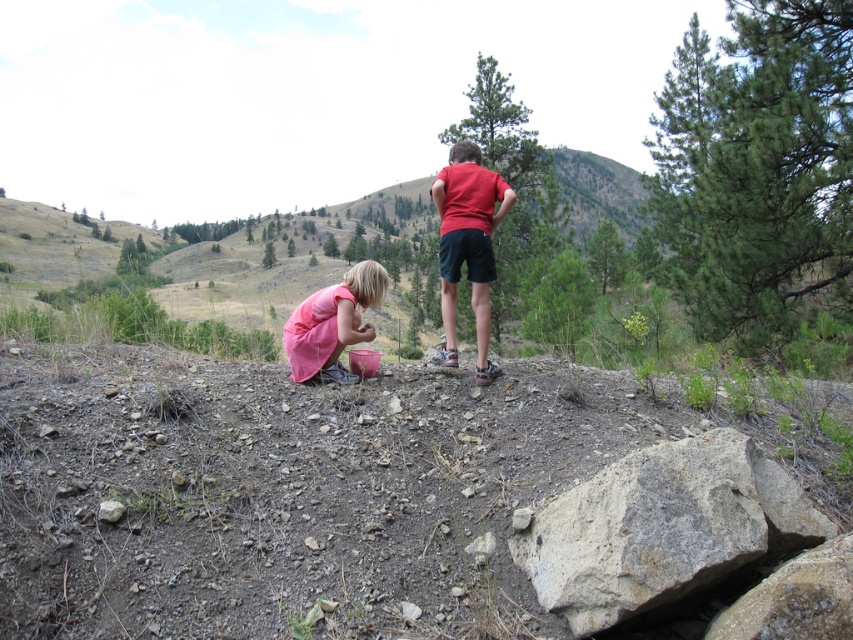
You are a photographer trying to capture both the red matte shirt at center and the pink matte dress at lower center in a single shot. Based on their positions, which one would appear closer to the camera in the photo?

The red matte shirt at center appears closer to the camera because it is positioned in front of the pink matte dress at lower center.

In the scene shown: You are a photographer trying to capture the gray rough rock at lower right in your shot. Based on the scene description, where should you position your camera to ensure the rock is centered in the frame?

The gray rough rock at lower right is located at the 2D coordinates point (x=662, y=528), so position the camera so that the center of the frame aligns with this coordinate to center the rock.

Looking at this image, you are a photographer trying to capture a clear photo of the pink matte dress at lower center without the gray rough rock at lower right blocking it. How should you adjust your camera position?

Move the camera backward to create distance between the gray rough rock at lower right and the pink matte dress at lower center, ensuring the rock no longer blocks the view of the dress.